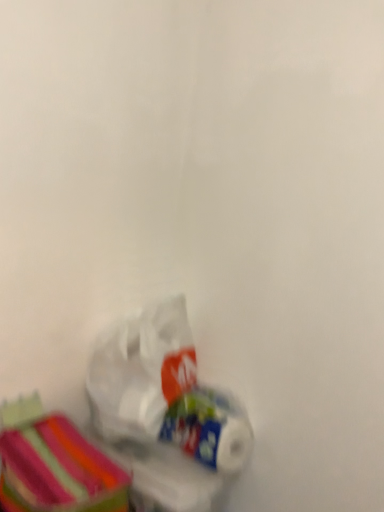
Question: Does white glossy toilet paper at lower center have a lesser width compared to translucent plastic bag at lower left?

Choices:
 (A) yes
 (B) no

Answer: (A)

Question: From a real-world perspective, is white glossy toilet paper at lower center below translucent plastic bag at lower left?

Choices:
 (A) no
 (B) yes

Answer: (B)

Question: Considering the relative sizes of white glossy toilet paper at lower center and translucent plastic bag at lower left in the image provided, is white glossy toilet paper at lower center taller than translucent plastic bag at lower left?

Choices:
 (A) no
 (B) yes

Answer: (A)

Question: From a real-world perspective, is white glossy toilet paper at lower center on translucent plastic bag at lower left?

Choices:
 (A) no
 (B) yes

Answer: (A)

Question: Is white glossy toilet paper at lower center bigger than translucent plastic bag at lower left?

Choices:
 (A) yes
 (B) no

Answer: (B)

Question: Considering the positions of translucent plastic bag at lower left and striped fabric storage box at lower left in the image, is translucent plastic bag at lower left taller or shorter than striped fabric storage box at lower left?

Choices:
 (A) short
 (B) tall

Answer: (B)

Question: Considering the positions of translucent plastic bag at lower left and striped fabric storage box at lower left in the image, is translucent plastic bag at lower left wider or thinner than striped fabric storage box at lower left?

Choices:
 (A) thin
 (B) wide

Answer: (A)

Question: Is translucent plastic bag at lower left in front of or behind striped fabric storage box at lower left in the image?

Choices:
 (A) front
 (B) behind

Answer: (B)

Question: Visually, is translucent plastic bag at lower left positioned to the left or to the right of striped fabric storage box at lower left?

Choices:
 (A) left
 (B) right

Answer: (B)

Question: Looking at their shapes, would you say translucent plastic bag at lower left is wider or thinner than white glossy toilet paper at lower center?

Choices:
 (A) thin
 (B) wide

Answer: (B)

Question: Considering their positions, is translucent plastic bag at lower left located in front of or behind white glossy toilet paper at lower center?

Choices:
 (A) behind
 (B) front

Answer: (B)

Question: Does point (135, 386) appear closer or farther from the camera than point (213, 452)?

Choices:
 (A) farther
 (B) closer

Answer: (A)

Question: Is translucent plastic bag at lower left inside or outside of white glossy toilet paper at lower center?

Choices:
 (A) inside
 (B) outside

Answer: (B)

Question: Visually, is striped fabric storage box at lower left positioned to the left or to the right of white glossy toilet paper at lower center?

Choices:
 (A) right
 (B) left

Answer: (B)

Question: Choose the correct answer: Is striped fabric storage box at lower left inside white glossy toilet paper at lower center or outside it?

Choices:
 (A) inside
 (B) outside

Answer: (B)